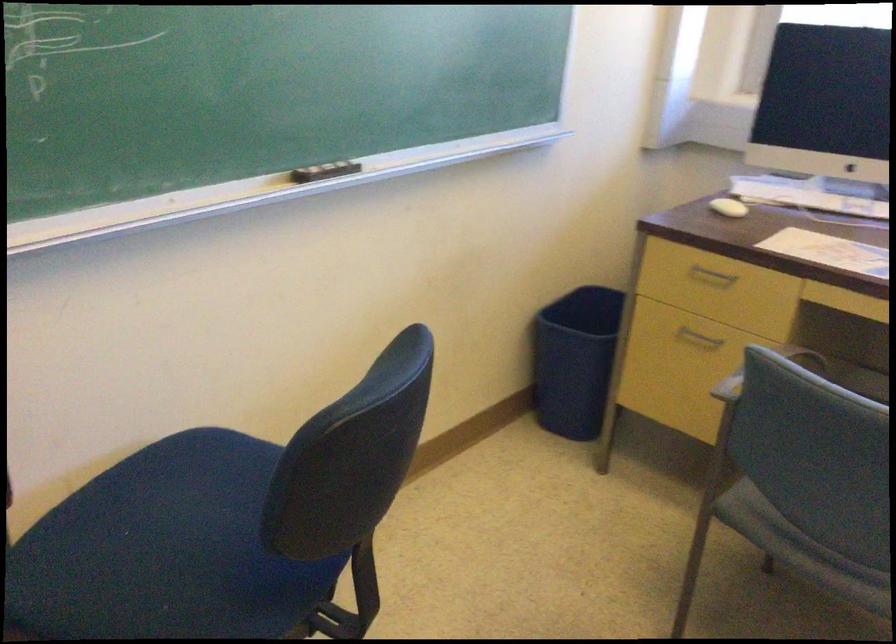
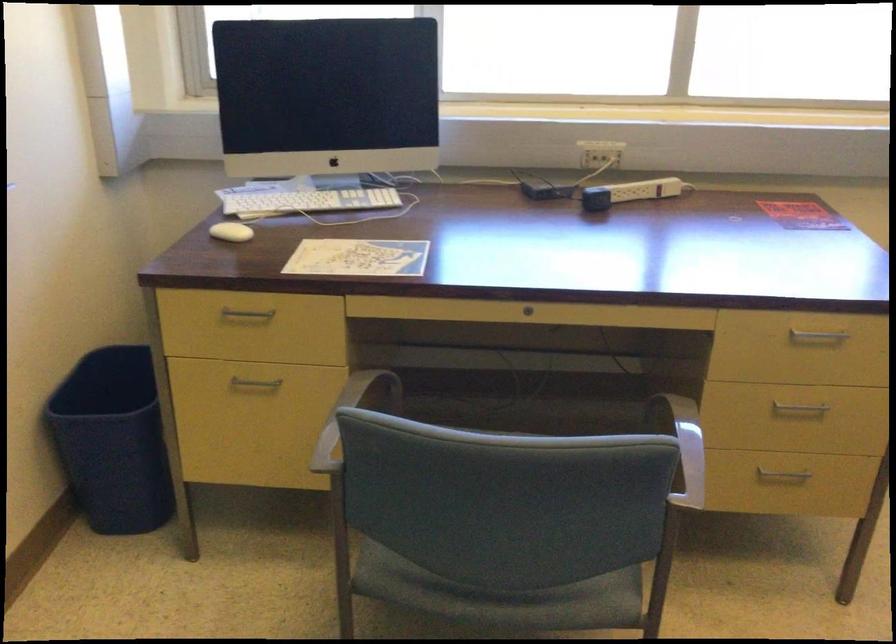
The point at (813, 193) is marked in the first image. Where is the corresponding point in the second image?

(304, 200)